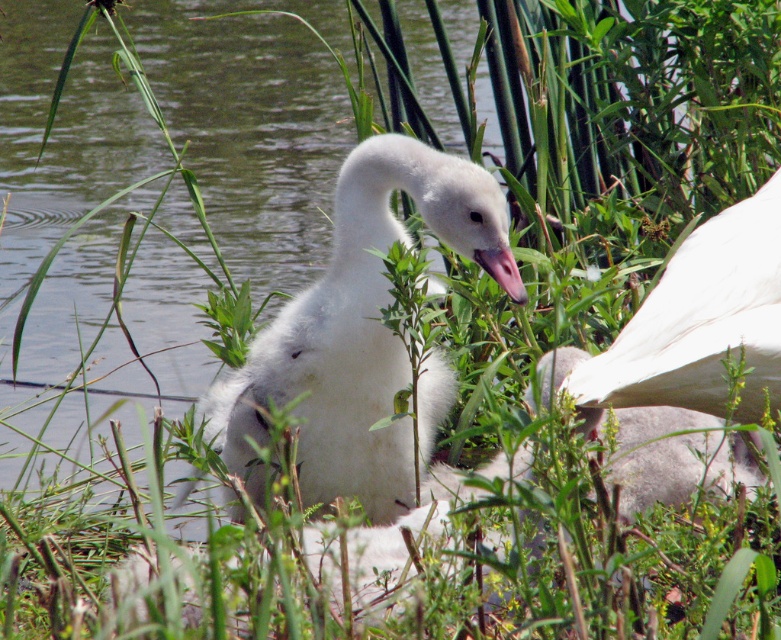
Is white fluffy swan at center positioned at the back of pink glossy beak at center?

Yes, white fluffy swan at center is further from the viewer.

Is point (341, 292) less distant than point (510, 278)?

No, (341, 292) is further to viewer.

Locate an element on the screen. The width and height of the screenshot is (781, 640). white fluffy swan at center is located at coordinates (358, 336).

Can you confirm if white fluffy duck at upper right is taller than pink glossy beak at center?

Indeed, white fluffy duck at upper right has a greater height compared to pink glossy beak at center.

Between point (767, 300) and point (491, 250), which one is positioned behind?

The point (767, 300) is behind.

The image size is (781, 640). Find the location of `white fluffy duck at upper right`. white fluffy duck at upper right is located at coordinates (701, 321).

Which is more to the left, white fluffy swan at center or white fluffy duck at upper right?

white fluffy swan at center is more to the left.

Is point (433, 412) closer to viewer compared to point (769, 282)?

No, (433, 412) is further to viewer.

Does point (352, 220) lie behind point (771, 339)?

Yes, it is.

This screenshot has height=640, width=781. What are the coordinates of `white fluffy swan at center` in the screenshot? It's located at (358, 336).